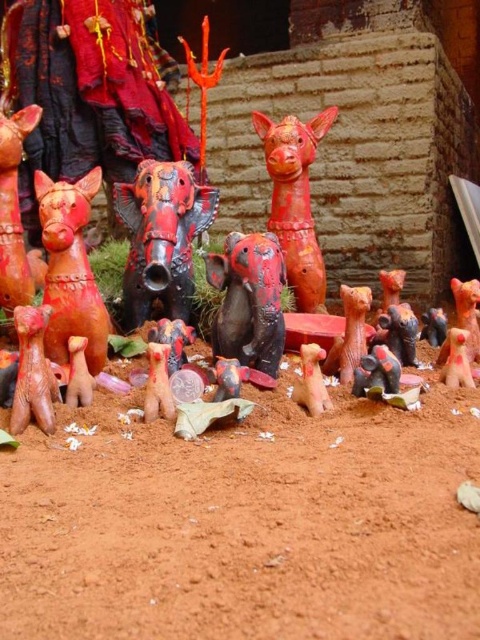
Between matte black elephant at center and matte red deer at lower left, which one has less height?

Standing shorter between the two is matte black elephant at center.

Who is positioned more to the right, matte black elephant at center or matte red deer at lower left?

matte black elephant at center is more to the right.

Which is behind, point (241, 296) or point (32, 124)?

The point (32, 124) is behind.

I want to click on matte black elephant at center, so click(x=249, y=300).

Who is higher up, brown clay dirt at center or matte red deer at lower left?

matte red deer at lower left

Is point (74, 417) positioned before point (10, 280)?

Yes, it is.

This screenshot has width=480, height=640. Identify the location of brown clay dirt at center. (244, 524).

Is brown clay dirt at center to the right of shiny red and black statue at center from the viewer's perspective?

Correct, you'll find brown clay dirt at center to the right of shiny red and black statue at center.

From the picture: Between brown clay dirt at center and shiny red and black statue at center, which one has more height?

shiny red and black statue at center

Which is in front, point (343, 624) or point (184, 220)?

Point (343, 624) is more forward.

In order to click on brown clay dirt at center in this screenshot , I will do `click(244, 524)`.